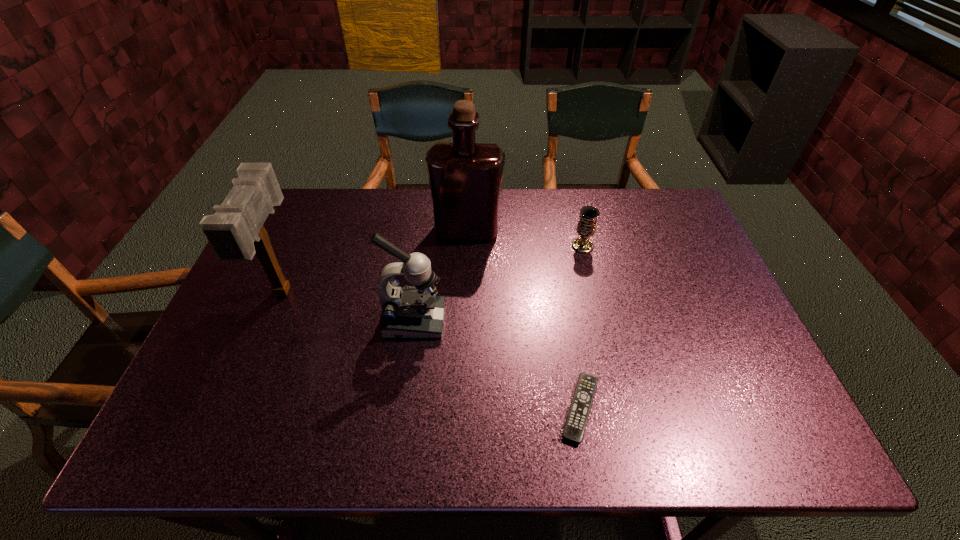
Image resolution: width=960 pixels, height=540 pixels. In order to click on vacant position located on the front of the rightmost object in this screenshot , I will do `click(611, 361)`.

Identify the location of vacant space located on the right of the remote control. (711, 409).

Identify the location of object at the far edge. Image resolution: width=960 pixels, height=540 pixels. (465, 177).

Where is `object situated at the near edge`? The width and height of the screenshot is (960, 540). object situated at the near edge is located at coordinates (575, 425).

Image resolution: width=960 pixels, height=540 pixels. What are the coordinates of `object positioned at the left edge` in the screenshot? It's located at (236, 233).

Locate an element on the screen. The image size is (960, 540). vacant space at the far edge is located at coordinates (540, 199).

Where is `vacant region at the left edge of the desktop`? The width and height of the screenshot is (960, 540). vacant region at the left edge of the desktop is located at coordinates (255, 355).

Identify the location of vacant space at the right edge of the desktop. (757, 410).

Find the location of a particular element. The height and width of the screenshot is (540, 960). vacant space at the far left corner is located at coordinates (326, 191).

In the image, there is a desktop. What are the coordinates of `free region at the near left corner` in the screenshot? It's located at (213, 441).